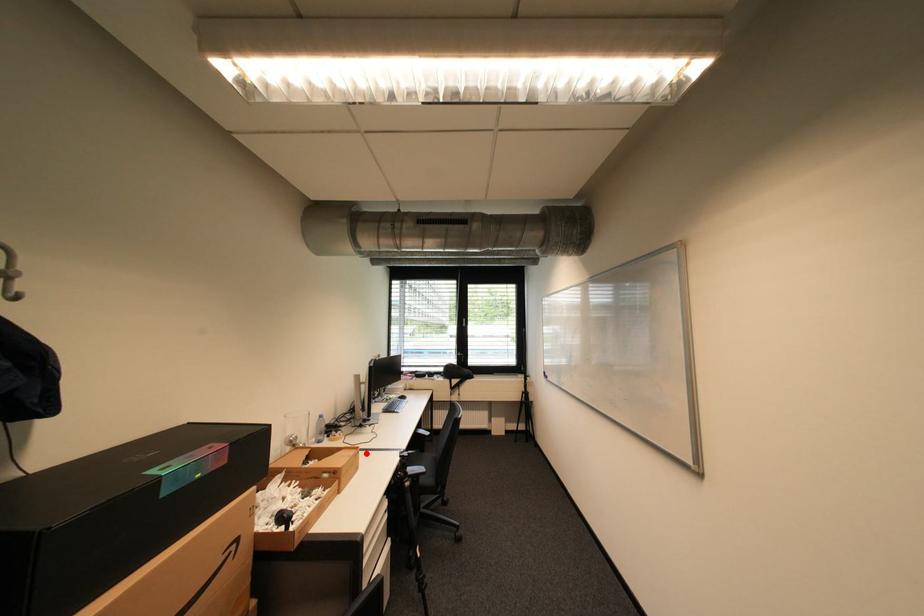
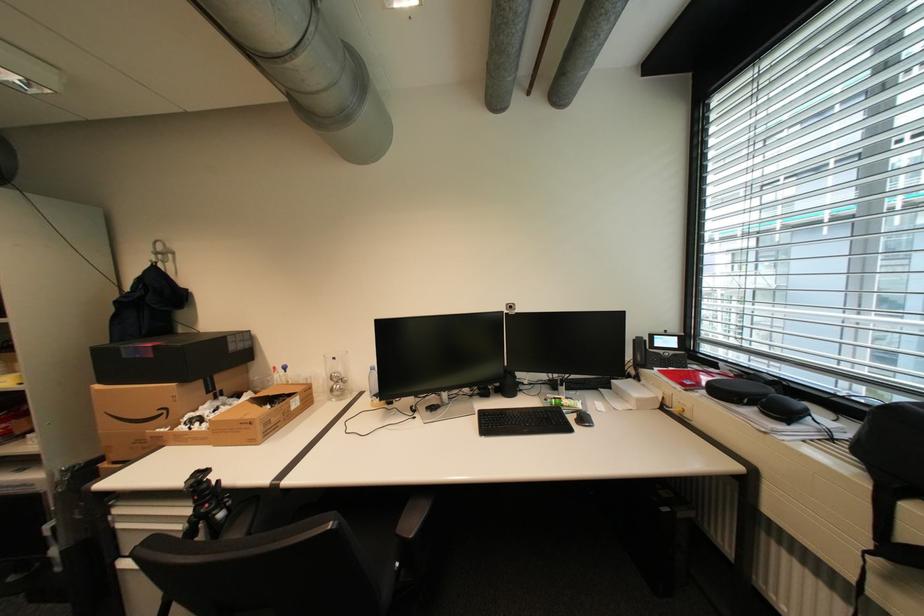
Question: I am providing you with two images of the same scene from different viewpoints. In image1, a red point is highlighted. Considering the same 3D point in image2, which of the following is correct?

Choices:
 (A) It is closer
 (B) It is farther

Answer: (B)